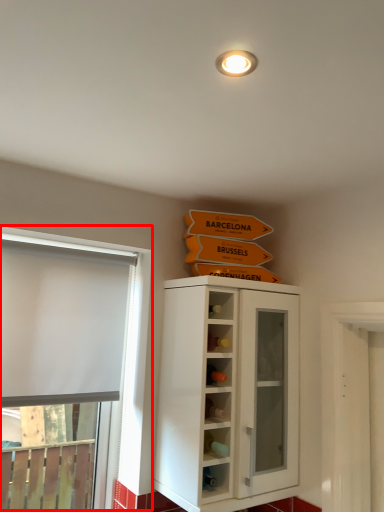
Question: Where is window (annotated by the red box) located in relation to cupboard in the image?

Choices:
 (A) left
 (B) right

Answer: (A)